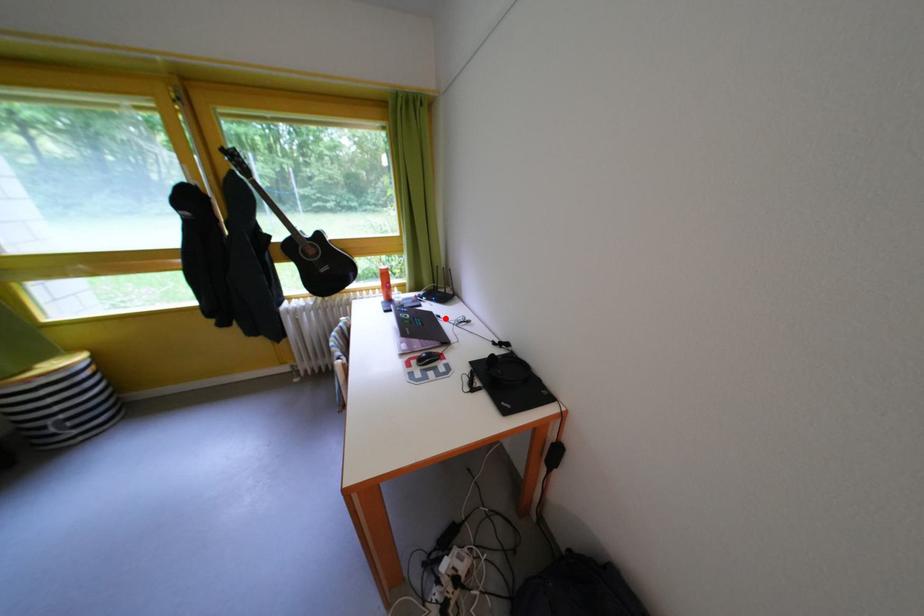
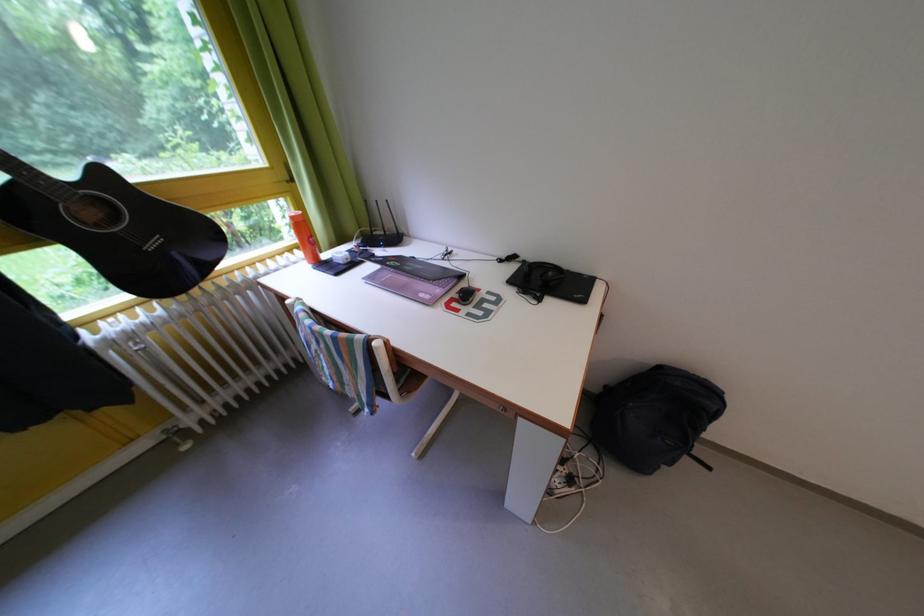
Where in the second image is the point corresponding to the highlighted location from the first image?

(417, 261)